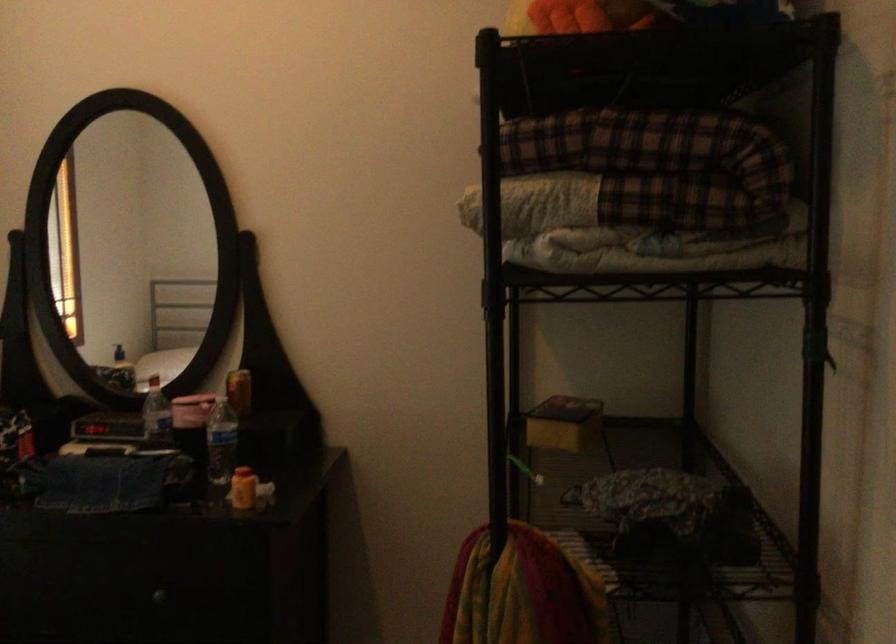
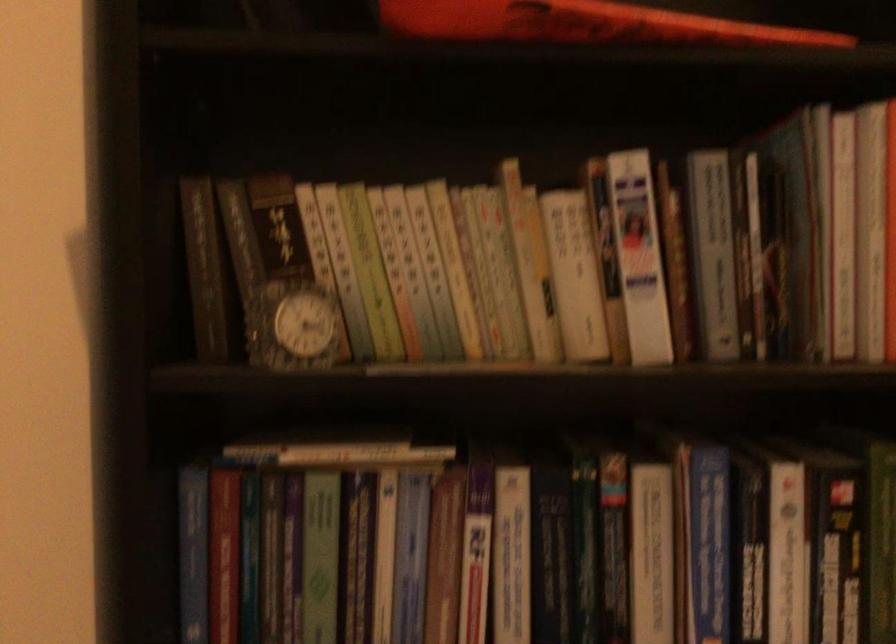
What movement of the cameraman would produce the second image?

The cameraman walked toward left, forward.